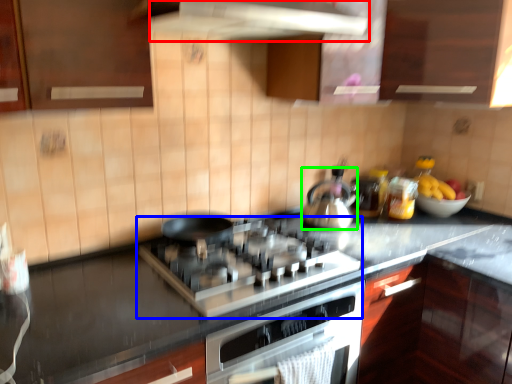
Question: Considering the real-world distances, which object is closest to exhaust hood (highlighted by a red box)? gas stove (highlighted by a blue box) or kitchen appliance (highlighted by a green box).

Choices:
 (A) gas stove
 (B) kitchen appliance

Answer: (A)